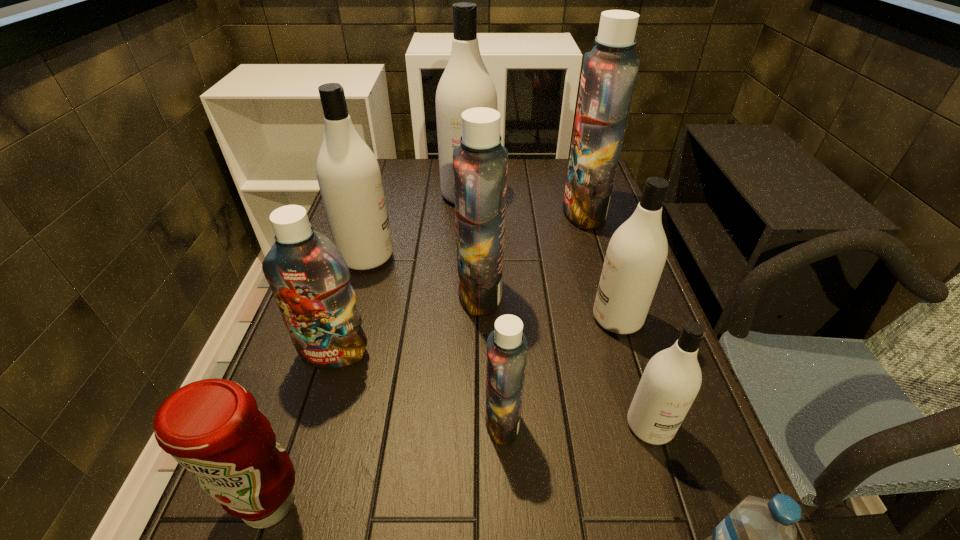
Identify the location of the biggest blue shampoo. (610, 69).

This screenshot has height=540, width=960. What are the coordinates of `the farthest blue shampoo` in the screenshot? It's located at (610, 69).

Find the location of a particular element. the farthest white shampoo is located at coordinates (465, 84).

The width and height of the screenshot is (960, 540). What are the coordinates of `the biggest white shampoo` in the screenshot? It's located at (465, 84).

The width and height of the screenshot is (960, 540). In order to click on the third smallest white shampoo in this screenshot , I will do `click(349, 177)`.

You are a GUI agent. You are given a task and a screenshot of the screen. Output one action in this format:
    pyautogui.click(x=<x>, y=<y>)
    Task: Click on the leftmost white shampoo
    
    Given the screenshot: What is the action you would take?
    pyautogui.click(x=349, y=177)

Find the location of `the third nearest blue shampoo`. the third nearest blue shampoo is located at coordinates (480, 163).

Where is `the second smallest white shampoo`? The image size is (960, 540). the second smallest white shampoo is located at coordinates (636, 254).

This screenshot has width=960, height=540. Find the location of `the sixth farthest object`. the sixth farthest object is located at coordinates (309, 278).

Image resolution: width=960 pixels, height=540 pixels. I want to click on the leftmost blue shampoo, so click(x=309, y=278).